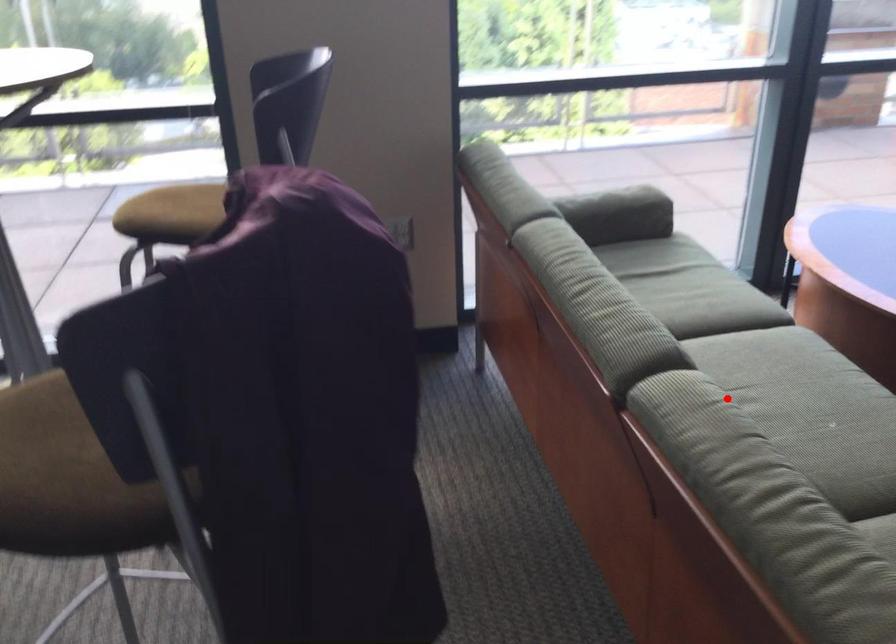
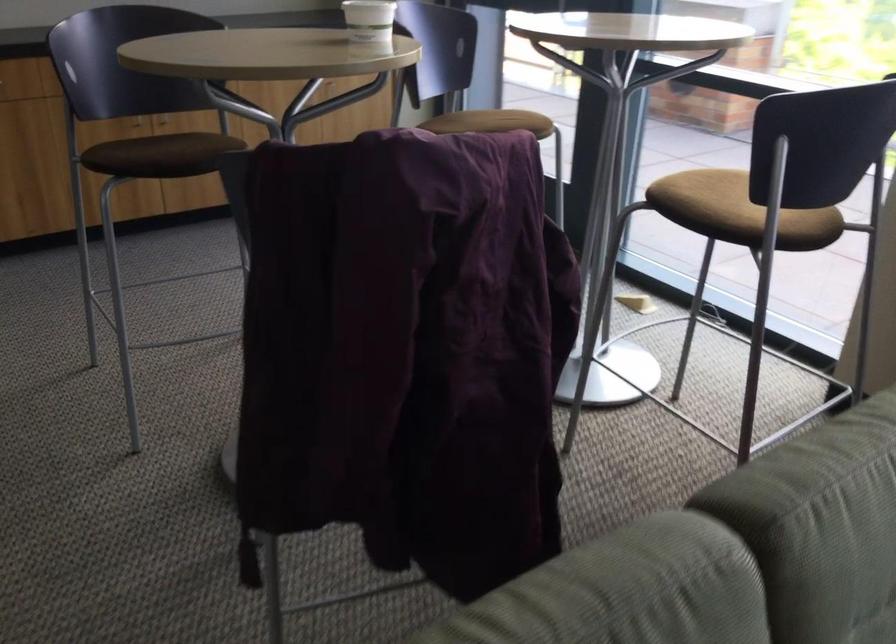
Find the pixel in the second image that matches the highlighted location in the first image.

(668, 585)